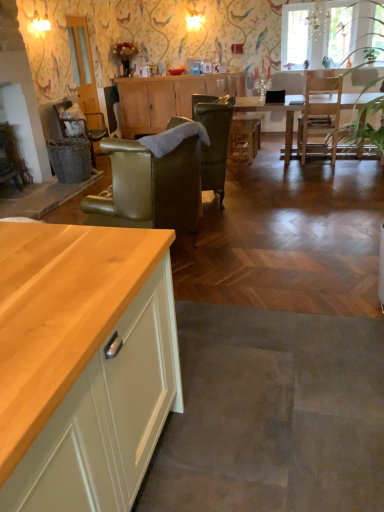
Measure the distance between point [83,96] and camera.

Point [83,96] and camera are 20.55 feet apart from each other.

What do you see at coordinates (84, 71) in the screenshot? The image size is (384, 512). I see `clear glass door at upper left` at bounding box center [84, 71].

Find the location of a particular element. clear glass door at upper left is located at coordinates click(84, 71).

From a real-world perspective, is wooden counter at lower left located beneath wooden cabinet at center?

Correct, in the physical world, wooden counter at lower left is lower than wooden cabinet at center.

How many degrees apart are the facing directions of wooden counter at lower left and wooden cabinet at center?

The angle between the facing direction of wooden counter at lower left and the facing direction of wooden cabinet at center is 89.4 degrees.

Would you say wooden counter at lower left contains wooden cabinet at center?

Actually, wooden cabinet at center is outside wooden counter at lower left.

Considering the relative sizes of wooden counter at lower left and wooden cabinet at center in the image provided, is wooden counter at lower left thinner than wooden cabinet at center?

No, wooden counter at lower left is not thinner than wooden cabinet at center.

Consider the image. Considering the sizes of wooden cabinet at center and matte orange bowl at center in the image, is wooden cabinet at center taller or shorter than matte orange bowl at center?

Considering their sizes, wooden cabinet at center has more height than matte orange bowl at center.

You are a GUI agent. You are given a task and a screenshot of the screen. Output one action in this format:
    pyautogui.click(x=<x>, y=<y>)
    Task: Click on the tableware lying behind the wooden cabinet at center
    
    Given the screenshot: What is the action you would take?
    pyautogui.click(x=176, y=70)

From a real-world perspective, is wooden cabinet at center located higher than matte orange bowl at center?

No, from a real-world perspective, wooden cabinet at center is not over matte orange bowl at center

Considering the relative positions of wooden cabinet at center and matte orange bowl at center in the image provided, is wooden cabinet at center to the right of matte orange bowl at center from the viewer's perspective?

Correct, you'll find wooden cabinet at center to the right of matte orange bowl at center.

Is matte orange bowl at center at the back of clear glass door at upper left?

No, clear glass door at upper left's orientation is not away from matte orange bowl at center.

Is matte orange bowl at center inside clear glass door at upper left?

No, matte orange bowl at center is located outside of clear glass door at upper left.

Is point (82, 81) behind point (177, 74)?

No, it is in front of (177, 74).

Locate an element on the screen. glass door on the left of matte orange bowl at center is located at coordinates (84, 71).

Can you tell me how much leather-like green armchair at center-left, the 2th chair when ordered from right to left, and matte orange bowl at center differ in facing direction?

There is a 106-degree angle between the facing directions of leather-like green armchair at center-left, the 2th chair when ordered from right to left, and matte orange bowl at center.

Is leather-like green armchair at center-left, the third chair positioned from the back, in contact with matte orange bowl at center?

No.

Measure the distance from leather-like green armchair at center-left, the 2th chair when ordered from right to left, to matte orange bowl at center.

leather-like green armchair at center-left, the 2th chair when ordered from right to left, and matte orange bowl at center are 13.56 feet apart from each other.

Based on their sizes in the image, would you say leather-like green armchair at center-left, the 2th chair when ordered from right to left, is bigger or smaller than matte orange bowl at center?

In the image, leather-like green armchair at center-left, the 2th chair when ordered from right to left, appears to be larger than matte orange bowl at center.

How much distance is there between leather-like green armchair at center-left, the 2th chair when ordered from right to left, and light brown wooden table at center?

leather-like green armchair at center-left, the 2th chair when ordered from right to left, and light brown wooden table at center are 14.04 feet apart.

Considering the positions of point (155, 191) and point (236, 99), is point (155, 191) closer or farther from the camera than point (236, 99)?

Point (155, 191) appears to be closer to the viewer than point (236, 99).

From the image's perspective, is leather-like green armchair at center-left, the third chair positioned from the back, above or below light brown wooden table at center?

leather-like green armchair at center-left, the third chair positioned from the back, is below light brown wooden table at center.

Is matte orange bowl at center far away from transparent glass window at upper center?

Yes, matte orange bowl at center is far from transparent glass window at upper center.

Does matte orange bowl at center come in front of transparent glass window at upper center?

No, matte orange bowl at center is further to the viewer.

From a real-world perspective, who is located higher, matte orange bowl at center or transparent glass window at upper center?

In real-world perspective, transparent glass window at upper center is above.

Looking at this image, which object is further away from the camera, transparent glass window at upper center or leather armchair at center, placed as the 3th chair when sorted from left to right?

transparent glass window at upper center is further from the camera.

Could you tell me if transparent glass window at upper center is turned towards leather armchair at center, arranged as the 1th chair when viewed from the right?

Yes, transparent glass window at upper center faces towards leather armchair at center, arranged as the 1th chair when viewed from the right.

Measure the distance from transparent glass window at upper center to leather armchair at center, which ranks as the second chair in back-to-front order.

They are 3.99 meters apart.

At what (x,y) coordinates should I click in order to perform the action: click on cabinetry above the wooden counter at lower left (from the image's perspective). Please return your answer as a coordinate pair (x, y). The width and height of the screenshot is (384, 512). Looking at the image, I should click on (168, 98).

The image size is (384, 512). In order to click on cabinetry that appears below the matte orange bowl at center (from the image's perspective) in this screenshot , I will do `click(168, 98)`.

Which object lies further to the anchor point wooden cabinet at center, leather armchair at center, which ranks as the second chair in back-to-front order, or wooden counter at lower left?

leather armchair at center, which ranks as the second chair in back-to-front order, lies further to wooden cabinet at center than the other object.

Based on their spatial positions, is rattan wicker chair at center, the 1th chair viewed from the back, or clear glass door at upper left further from transparent glass window at upper center?

rattan wicker chair at center, the 1th chair viewed from the back, is further to transparent glass window at upper center.

From the image, which object appears to be nearer to transparent glass window at upper center, leather-like green armchair at center-left, the 2th chair when ordered from right to left, or matte orange bowl at center?

matte orange bowl at center is closer to transparent glass window at upper center.

From the image, which object appears to be farther from matte orange bowl at center, wooden cabinet at center or rattan wicker chair at center, which appears as the third chair when viewed from the front?

Answer: The object further to matte orange bowl at center is rattan wicker chair at center, which appears as the third chair when viewed from the front.

Based on their spatial positions, is transparent glass window at upper center or leather armchair at center, positioned as the second chair in front-to-back order, closer to rattan wicker chair at center, which appears as the third chair when viewed from the front?

leather armchair at center, positioned as the second chair in front-to-back order, lies closer to rattan wicker chair at center, which appears as the third chair when viewed from the front, than the other object.

Looking at the image, which one is located closer to wooden cabinet at center, clear glass door at upper left or matte orange bowl at center?

matte orange bowl at center is closer to wooden cabinet at center.

Based on their spatial positions, is transparent glass window at upper center or leather armchair at center, placed as the 3th chair when sorted from left to right, further from clear glass door at upper left?

transparent glass window at upper center is further to clear glass door at upper left.

Which object lies further to the anchor point transparent glass window at upper center, light brown wooden table at center or clear glass door at upper left?

The object further to transparent glass window at upper center is clear glass door at upper left.

Image resolution: width=384 pixels, height=512 pixels. Find the location of `chair positioned between leather armchair at center, placed as the 3th chair when sorted from left to right, and clear glass door at upper left from near to far`. chair positioned between leather armchair at center, placed as the 3th chair when sorted from left to right, and clear glass door at upper left from near to far is located at coordinates (79, 127).

Identify the location of kitchen & dining room table between clear glass door at upper left and transparent glass window at upper center. (273, 110).

Identify the location of cabinetry situated between rattan wicker chair at center, the 1th chair viewed from the back, and light brown wooden table at center from left to right. (168, 98).

Where is `cabinetry between clear glass door at upper left and light brown wooden table at center`? cabinetry between clear glass door at upper left and light brown wooden table at center is located at coordinates (168, 98).